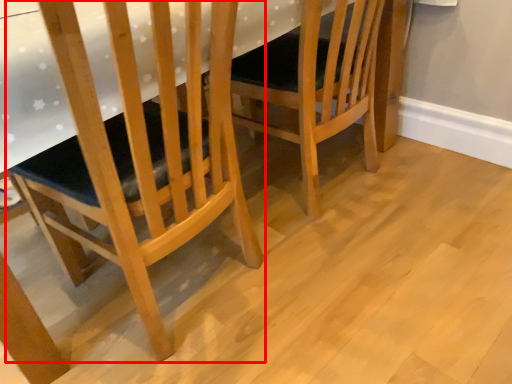
Question: From the image's perspective, where is chair (annotated by the red box) located relative to chair?

Choices:
 (A) above
 (B) below

Answer: (B)